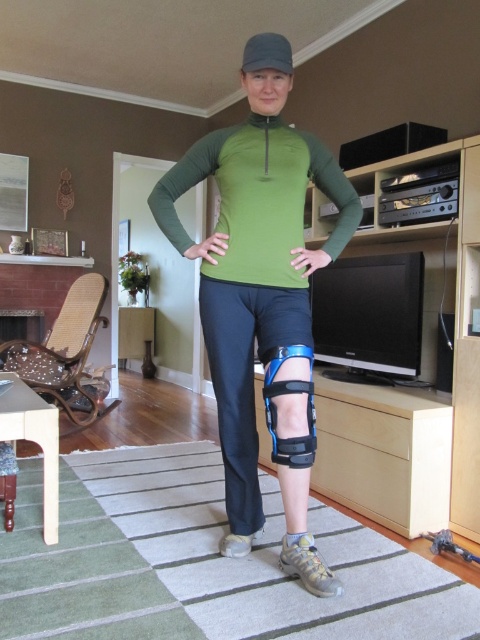
Locate an element on the screen. green matte knee brace at center is located at coordinates (260, 282).

Can you confirm if green matte knee brace at center is positioned to the right of matte gray shoe at lower center?

No, green matte knee brace at center is not to the right of matte gray shoe at lower center.

Between point (241, 556) and point (285, 540), which one is positioned in front?

Point (285, 540) is more forward.

Image resolution: width=480 pixels, height=640 pixels. What are the coordinates of `green matte knee brace at center` in the screenshot? It's located at (260, 282).

Can you confirm if green matte knee brace at center is positioned below blue plastic knee pad at center?

No, green matte knee brace at center is not below blue plastic knee pad at center.

Which of these two, green matte knee brace at center or blue plastic knee pad at center, stands shorter?

Standing shorter between the two is blue plastic knee pad at center.

Locate an element on the screen. This screenshot has width=480, height=640. green matte knee brace at center is located at coordinates (260, 282).

Consider the image. Which is more to the left, blue plastic knee pad at center or matte gray shoe at lower center?

blue plastic knee pad at center is more to the left.

Does blue plastic knee pad at center lie behind matte gray shoe at lower center?

No, blue plastic knee pad at center is in front of matte gray shoe at lower center.

Image resolution: width=480 pixels, height=640 pixels. Find the location of `blue plastic knee pad at center`. blue plastic knee pad at center is located at coordinates (276, 406).

Image resolution: width=480 pixels, height=640 pixels. Find the location of `blue plastic knee pad at center`. blue plastic knee pad at center is located at coordinates (276, 406).